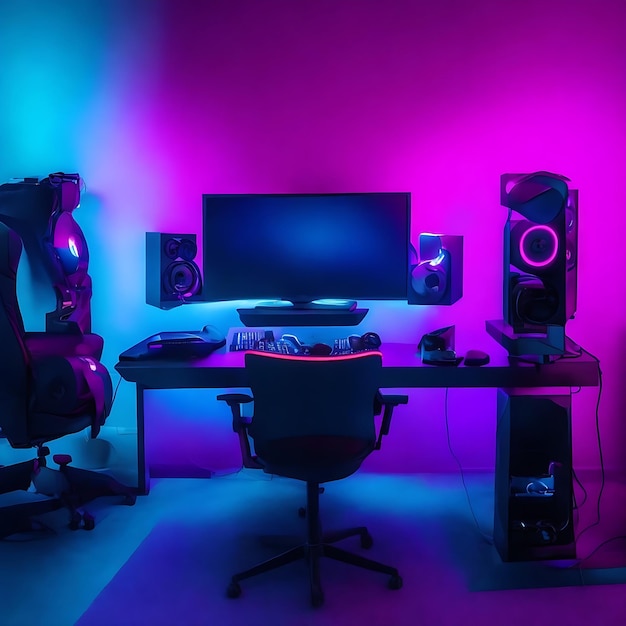
Image resolution: width=626 pixels, height=626 pixels. Identify the location of computer chair. [11, 366], [293, 416].